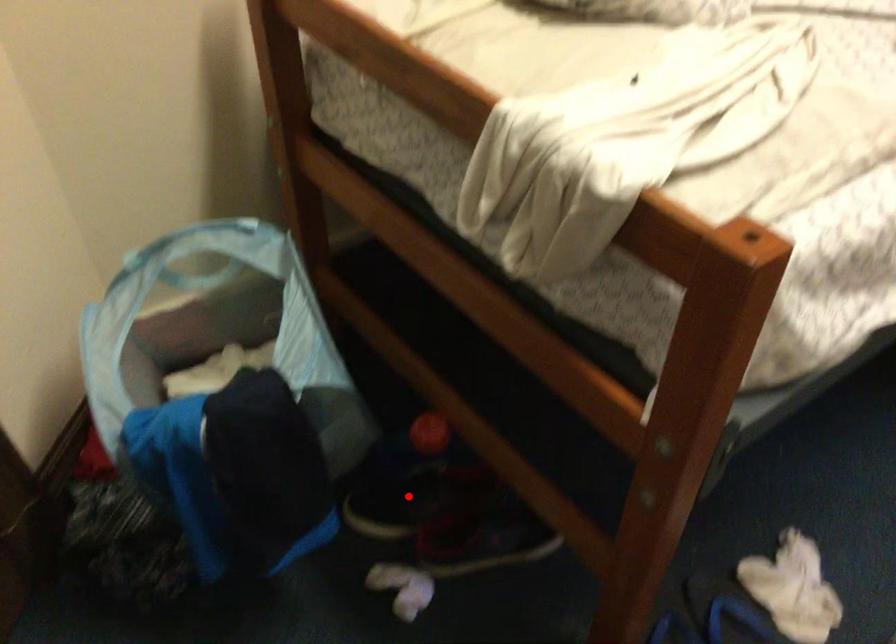
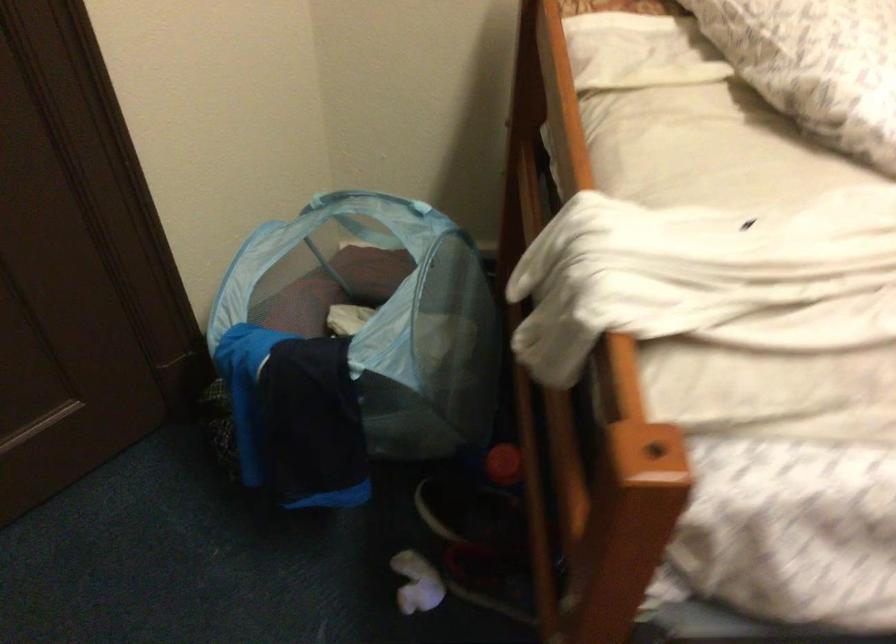
The point at the highlighted location is marked in the first image. Where is the corresponding point in the second image?

(469, 509)